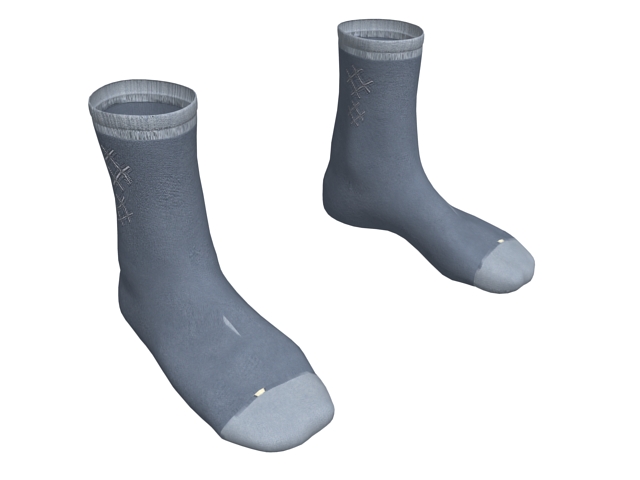
Locate an element on the screen. The height and width of the screenshot is (480, 640). left sock displayed in image is located at coordinates (172, 281).